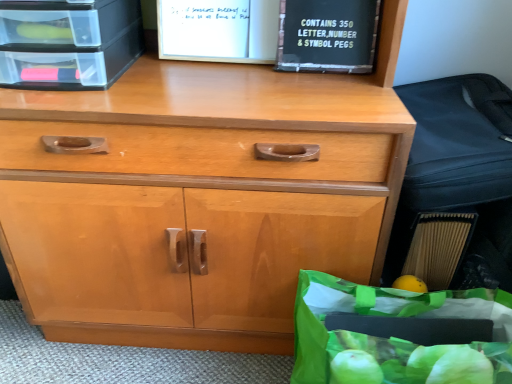
Question: Does clear plastic crate at upper left appear on the right side of black plastic sign at upper right?

Choices:
 (A) yes
 (B) no

Answer: (B)

Question: From the image's perspective, is clear plastic crate at upper left located above black plastic sign at upper right?

Choices:
 (A) yes
 (B) no

Answer: (B)

Question: Would you say black plastic sign at upper right is part of clear plastic crate at upper left's contents?

Choices:
 (A) no
 (B) yes

Answer: (A)

Question: Is clear plastic crate at upper left bigger than black plastic sign at upper right?

Choices:
 (A) no
 (B) yes

Answer: (B)

Question: Is the depth of clear plastic crate at upper left greater than that of black plastic sign at upper right?

Choices:
 (A) yes
 (B) no

Answer: (B)

Question: Considering the positions of black plastic sign at upper right and clear plastic crate at upper left in the image, is black plastic sign at upper right bigger or smaller than clear plastic crate at upper left?

Choices:
 (A) small
 (B) big

Answer: (A)

Question: From their relative heights in the image, would you say black plastic sign at upper right is taller or shorter than clear plastic crate at upper left?

Choices:
 (A) tall
 (B) short

Answer: (B)

Question: Does point (308, 41) appear closer or farther from the camera than point (123, 64)?

Choices:
 (A) farther
 (B) closer

Answer: (B)

Question: Considering the positions of black plastic sign at upper right and clear plastic crate at upper left in the image, is black plastic sign at upper right wider or thinner than clear plastic crate at upper left?

Choices:
 (A) wide
 (B) thin

Answer: (B)

Question: Considering their positions, is black plastic book at upper center located in front of or behind clear plastic crate at upper left?

Choices:
 (A) behind
 (B) front

Answer: (A)

Question: In terms of height, does black plastic book at upper center look taller or shorter compared to clear plastic crate at upper left?

Choices:
 (A) short
 (B) tall

Answer: (A)

Question: Is black plastic book at upper center inside or outside of clear plastic crate at upper left?

Choices:
 (A) inside
 (B) outside

Answer: (B)

Question: Considering the positions of black plastic book at upper center and clear plastic crate at upper left in the image, is black plastic book at upper center wider or thinner than clear plastic crate at upper left?

Choices:
 (A) thin
 (B) wide

Answer: (A)

Question: Is point (77, 87) positioned closer to the camera than point (291, 62)?

Choices:
 (A) closer
 (B) farther

Answer: (A)

Question: Is clear plastic crate at upper left taller or shorter than black plastic sign at upper right?

Choices:
 (A) tall
 (B) short

Answer: (A)